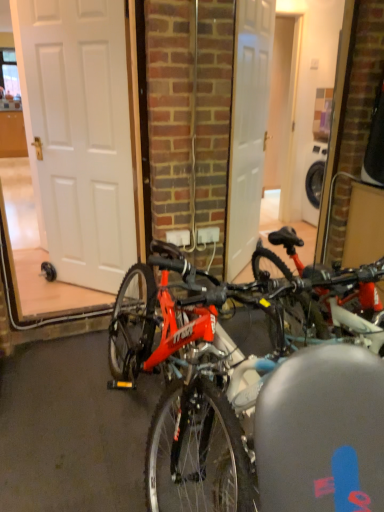
Question: Is shiny red bicycle at center positioned with its back to white matte door at left?

Choices:
 (A) no
 (B) yes

Answer: (A)

Question: Does shiny red bicycle at center come behind white matte door at left?

Choices:
 (A) no
 (B) yes

Answer: (A)

Question: From the image's perspective, is shiny red bicycle at center located beneath white matte door at left?

Choices:
 (A) yes
 (B) no

Answer: (A)

Question: Considering the relative sizes of shiny red bicycle at center and white matte door at left in the image provided, is shiny red bicycle at center thinner than white matte door at left?

Choices:
 (A) yes
 (B) no

Answer: (B)

Question: Can you confirm if shiny red bicycle at center is bigger than white matte door at left?

Choices:
 (A) no
 (B) yes

Answer: (B)

Question: Is shiny red bicycle at center completely or partially outside of white matte door at left?

Choices:
 (A) yes
 (B) no

Answer: (A)

Question: Would you say shiny red bicycle at center is part of white matte door at left's contents?

Choices:
 (A) yes
 (B) no

Answer: (B)

Question: Does white matte door at left have a greater height compared to shiny red bicycle at center?

Choices:
 (A) no
 (B) yes

Answer: (B)

Question: Does white matte door at left have a greater width compared to shiny red bicycle at center?

Choices:
 (A) no
 (B) yes

Answer: (A)

Question: From the image's perspective, does white matte door at left appear lower than shiny red bicycle at center?

Choices:
 (A) yes
 (B) no

Answer: (B)

Question: Is white matte door at left looking in the opposite direction of shiny red bicycle at center?

Choices:
 (A) no
 (B) yes

Answer: (A)

Question: Considering the relative sizes of white matte door at left and shiny red bicycle at center in the image provided, is white matte door at left shorter than shiny red bicycle at center?

Choices:
 (A) yes
 (B) no

Answer: (B)

Question: From a real-world perspective, is shiny red bicycle at center above or below white matte door at left?

Choices:
 (A) below
 (B) above

Answer: (A)